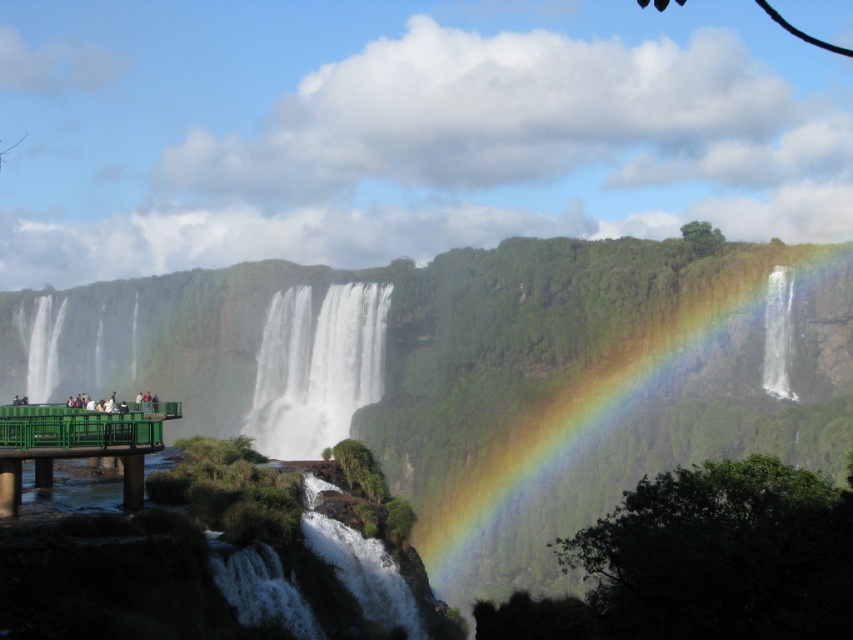
You are standing on the wooden observation platform and want to take a photo of the white smooth waterfall at left without the green metallic railing at lower left blocking the view. Is it possible to position yourself in such a way that the railing is not in the frame?

The green metallic railing at lower left is located below the white smooth waterfall at left, so if you position yourself higher or move to the right side of the platform, you can avoid the railing blocking the view of the waterfall.